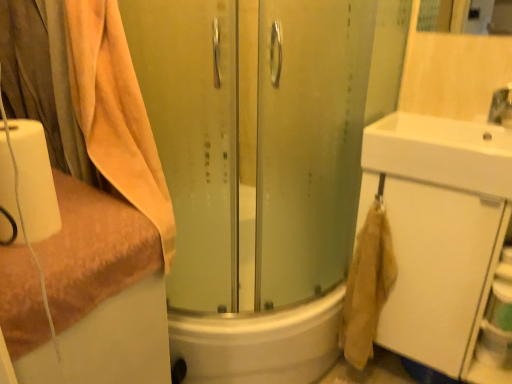
What are the coordinates of `white matte toilet paper at left` in the screenshot? It's located at (34, 180).

Image resolution: width=512 pixels, height=384 pixels. What do you see at coordinates (34, 180) in the screenshot?
I see `white matte toilet paper at left` at bounding box center [34, 180].

This screenshot has height=384, width=512. What do you see at coordinates (441, 152) in the screenshot?
I see `white glossy sink at upper right` at bounding box center [441, 152].

The image size is (512, 384). Describe the element at coordinates (94, 250) in the screenshot. I see `orange terry cloth towel at left, the second towel viewed from the top` at that location.

Describe the element at coordinates (367, 286) in the screenshot. The height and width of the screenshot is (384, 512). I see `beige cotton towel at lower right` at that location.

This screenshot has height=384, width=512. I want to click on beige cotton towel at lower right, so tap(367, 286).

Locate an element on the screen. white matte toilet paper at left is located at coordinates (34, 180).

Is white matte toilet paper at left not within white glossy sink at upper right?

Yes, white matte toilet paper at left is not within white glossy sink at upper right.

From a real-world perspective, is white matte toilet paper at left located beneath white glossy sink at upper right?

Actually, white matte toilet paper at left is physically above white glossy sink at upper right in the real world.

Considering the relative sizes of white matte toilet paper at left and white glossy sink at upper right in the image provided, is white matte toilet paper at left thinner than white glossy sink at upper right?

Yes.

From their relative heights in the image, would you say orange terry cloth towel at left, the 1th towel positioned from the bottom, is taller or shorter than white matte toilet paper at left?

orange terry cloth towel at left, the 1th towel positioned from the bottom, is taller than white matte toilet paper at left.

Does orange terry cloth towel at left, the 1th towel positioned from the bottom, appear on the left side of white matte toilet paper at left?

Yes.

Considering the positions of objects orange terry cloth towel at left, the 1th towel positioned from the bottom, and white matte toilet paper at left in the image provided, who is in front, orange terry cloth towel at left, the 1th towel positioned from the bottom, or white matte toilet paper at left?

Positioned in front is orange terry cloth towel at left, the 1th towel positioned from the bottom.

From the image's perspective, is orange terry cloth towel at left, the second towel viewed from the top, positioned above or below white matte toilet paper at left?

orange terry cloth towel at left, the second towel viewed from the top, is below white matte toilet paper at left.

Between white glossy sink at upper right and white matte toilet paper at left, which one appears on the right side from the viewer's perspective?

white glossy sink at upper right is more to the right.

Is white glossy sink at upper right outside of white matte toilet paper at left?

white glossy sink at upper right is positioned outside white matte toilet paper at left.

Is point (487, 170) positioned in front of point (22, 201)?

That is False.

How distant is white glossy sink at upper right from white matte toilet paper at left?

A distance of 38.71 inches exists between white glossy sink at upper right and white matte toilet paper at left.

Does white matte toilet paper at left come in front of orange terry cloth towel at left, the 1th towel positioned from the bottom?

That is False.

Is white matte toilet paper at left not near orange terry cloth towel at left, the second towel viewed from the top?

white matte toilet paper at left is actually quite close to orange terry cloth towel at left, the second towel viewed from the top.

The image size is (512, 384). Find the location of `towel below the white matte toilet paper at left (from the image's perspective)`. towel below the white matte toilet paper at left (from the image's perspective) is located at coordinates (94, 250).

How different are the orientations of beige cotton towel at lower right and beige cotton towel at left, acting as the 2th towel starting from the bottom, in degrees?

There is a 90-degree angle between the facing directions of beige cotton towel at lower right and beige cotton towel at left, acting as the 2th towel starting from the bottom.

Is point (370, 245) closer or farther from the camera than point (106, 74)?

Point (370, 245) appears to be farther away from the viewer than point (106, 74).

From the image's perspective, is beige cotton towel at lower right positioned above or below beige cotton towel at left, acting as the first towel starting from the top?

beige cotton towel at lower right is situated lower than beige cotton towel at left, acting as the first towel starting from the top, in the image.

Which object is positioned more to the right, beige cotton towel at lower right or beige cotton towel at left, acting as the 2th towel starting from the bottom?

beige cotton towel at lower right is more to the right.

Which of these two, orange terry cloth towel at left, the 1th towel positioned from the bottom, or white matte cabinet at right, is thinner?

white matte cabinet at right.

Consider the image. Which object is closer to the camera, orange terry cloth towel at left, the second towel viewed from the top, or white matte cabinet at right?

Positioned in front is orange terry cloth towel at left, the second towel viewed from the top.

From a real-world perspective, between orange terry cloth towel at left, the second towel viewed from the top, and white matte cabinet at right, who is vertically lower?

white matte cabinet at right, from a real-world perspective.

From the image's perspective, is orange terry cloth towel at left, the second towel viewed from the top, located above or below white matte cabinet at right?

Clearly, from the image's perspective, orange terry cloth towel at left, the second towel viewed from the top, is below white matte cabinet at right.

Does point (368, 184) lie behind point (76, 75)?

Yes, point (368, 184) is behind point (76, 75).

From the image's perspective, which is below, white matte cabinet at right or beige cotton towel at left, acting as the first towel starting from the top?

white matte cabinet at right, from the image's perspective.

From a real-world perspective, is white matte cabinet at right located beneath beige cotton towel at left, acting as the first towel starting from the top?

Yes, from a real-world perspective, white matte cabinet at right is below beige cotton towel at left, acting as the first towel starting from the top.

Considering the sizes of objects white matte cabinet at right and beige cotton towel at left, acting as the 2th towel starting from the bottom, in the image provided, who is shorter, white matte cabinet at right or beige cotton towel at left, acting as the 2th towel starting from the bottom,?

With less height is beige cotton towel at left, acting as the 2th towel starting from the bottom.

Identify the location of toilet paper above the white glossy sink at upper right (from a real-world perspective). (34, 180).

At what (x,y) coordinates should I click in order to perform the action: click on toilet paper above the orange terry cloth towel at left, the second towel viewed from the top (from the image's perspective). Please return your answer as a coordinate pair (x, y). Image resolution: width=512 pixels, height=384 pixels. Looking at the image, I should click on (34, 180).

When comparing their distances from white matte toilet paper at left, does white glossy sink at upper right or white matte cabinet at right seem closer?

white glossy sink at upper right.

Estimate the real-world distances between objects in this image. Which object is further from beige cotton towel at lower right, orange terry cloth towel at left, the second towel viewed from the top, or white matte cabinet at right?

Based on the image, orange terry cloth towel at left, the second towel viewed from the top, appears to be further to beige cotton towel at lower right.

Looking at the image, which one is located further to white matte toilet paper at left, beige cotton towel at left, acting as the first towel starting from the top, or white matte cabinet at right?

Based on the image, white matte cabinet at right appears to be further to white matte toilet paper at left.

Estimate the real-world distances between objects in this image. Which object is closer to white matte toilet paper at left, orange terry cloth towel at left, the second towel viewed from the top, or beige cotton towel at left, acting as the 2th towel starting from the bottom?

orange terry cloth towel at left, the second towel viewed from the top, lies closer to white matte toilet paper at left than the other object.

Estimate the real-world distances between objects in this image. Which object is closer to orange terry cloth towel at left, the 1th towel positioned from the bottom, white matte cabinet at right or white glossy sink at upper right?

Based on the image, white glossy sink at upper right appears to be nearer to orange terry cloth towel at left, the 1th towel positioned from the bottom.

Based on their spatial positions, is beige cotton towel at left, acting as the first towel starting from the top, or white glossy sink at upper right closer to orange terry cloth towel at left, the second towel viewed from the top?

beige cotton towel at left, acting as the first towel starting from the top, lies closer to orange terry cloth towel at left, the second towel viewed from the top, than the other object.

Which object lies nearer to the anchor point beige cotton towel at left, acting as the first towel starting from the top, white matte toilet paper at left or beige cotton towel at lower right?

white matte toilet paper at left.

When comparing their distances from white matte toilet paper at left, does white matte cabinet at right or beige cotton towel at lower right seem closer?

Among the two, beige cotton towel at lower right is located nearer to white matte toilet paper at left.

Find the location of a particular element. bath towel located between orange terry cloth towel at left, the 1th towel positioned from the bottom, and white glossy sink at upper right in the left-right direction is located at coordinates (367, 286).

I want to click on bath towel between white matte toilet paper at left and white matte cabinet at right from left to right, so click(367, 286).

The height and width of the screenshot is (384, 512). Find the location of `bath towel located between beige cotton towel at left, acting as the 2th towel starting from the bottom, and white glossy sink at upper right in the left-right direction`. bath towel located between beige cotton towel at left, acting as the 2th towel starting from the bottom, and white glossy sink at upper right in the left-right direction is located at coordinates (367, 286).

The height and width of the screenshot is (384, 512). Find the location of `sink situated between beige cotton towel at left, acting as the 2th towel starting from the bottom, and white matte cabinet at right from left to right`. sink situated between beige cotton towel at left, acting as the 2th towel starting from the bottom, and white matte cabinet at right from left to right is located at coordinates (441, 152).